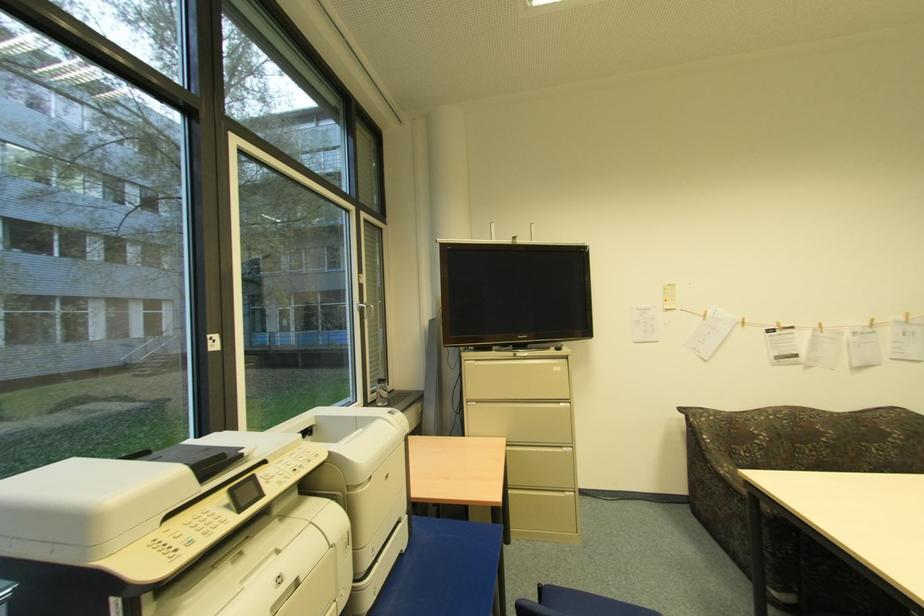
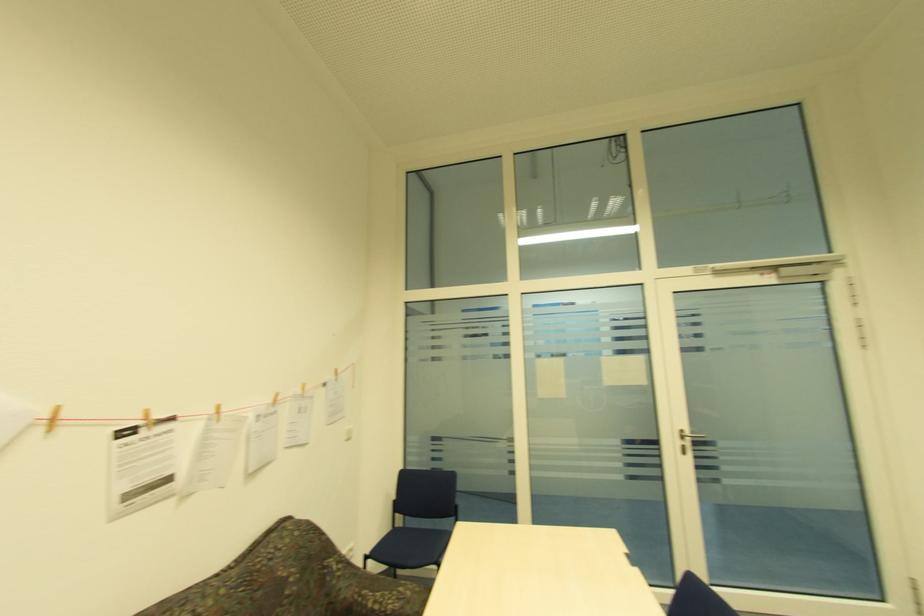
Where in the second image is the point corresponding to (745,321) from the first image?

(49, 416)